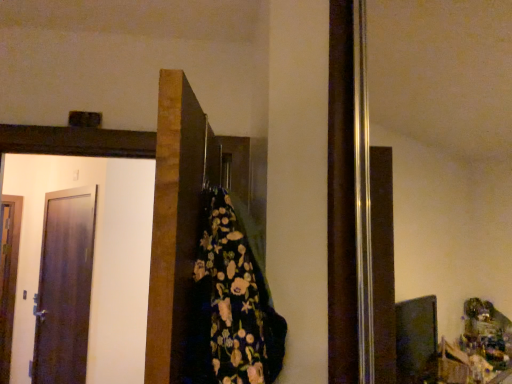
Question: Considering their positions, is wooden door at left, arranged as the 1th door when viewed from the back, located in front of or behind dark brown wooden door at center, arranged as the 3th door when viewed from the left?

Choices:
 (A) behind
 (B) front

Answer: (A)

Question: From a real-world perspective, relative to dark brown wooden door at center, which is counted as the first door, starting from the front, is wooden door at left, acting as the 3th door starting from the front, vertically above or below?

Choices:
 (A) below
 (B) above

Answer: (A)

Question: Considering the real-world distances, which object is closest to the floral-patterned fabric at center?

Choices:
 (A) dark brown wooden door at center, arranged as the 3th door when viewed from the left
 (B) matte dark brown door at left, the 2th door when ordered from right to left
 (C) wooden door at left, acting as the 3th door starting from the front

Answer: (A)

Question: Which object is positioned farthest from the matte dark brown door at left, arranged as the 2th door when viewed from the left?

Choices:
 (A) floral-patterned fabric at center
 (B) dark brown wooden door at center, which is counted as the first door, starting from the front
 (C) wooden door at left, acting as the 3th door starting from the front

Answer: (A)